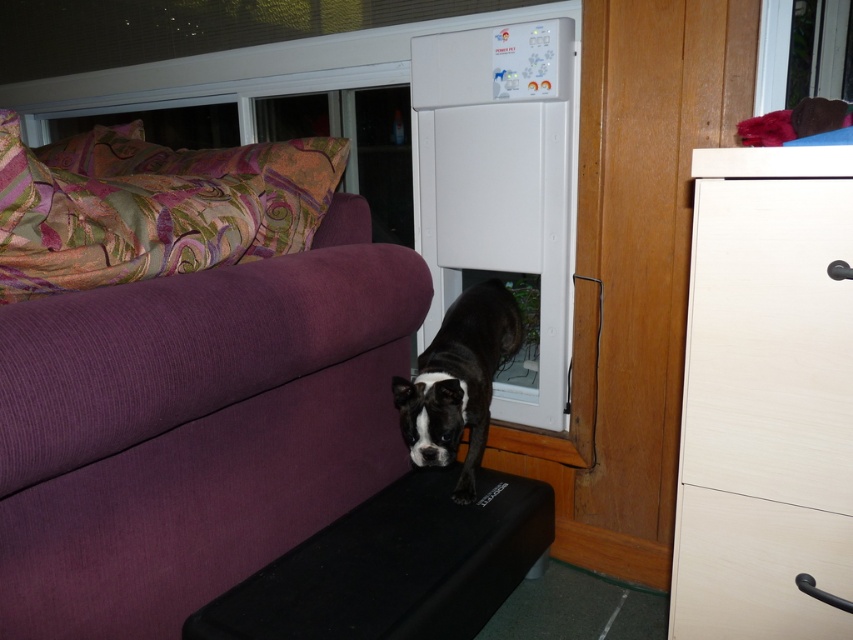
You are a delivery person holding a package that is 1.35 meters long. You need to enter the house through the white plastic screen door at center. Can you fit through the door without bending down?

The white plastic screen door at center is 1.40 meters from camera. Since the distance from the camera to the door is 1.40 meters, this measurement doesn not directly indicate the height of the door. Therefore, it is unclear if the package will fit through the door without more information about the door height.

You are a pet owner who wants to place a small toy between the white plastic screen door at center and the black rubber footrest at lower center. Can you place the toy directly in between them?

The white plastic screen door at center is positioned over the black rubber footrest at lower center, so placing a toy directly between them would require placing it underneath the screen door and above the footrest, which is possible as they are vertically aligned.

You are a dog owner who wants to ensure your pet can access the yard safely. You notice the white plastic screen door at center and the black rubber footrest at lower center. Which object is larger in size?

The white plastic screen door at center is bigger than the black rubber footrest at lower center, so the screen door is larger in size.